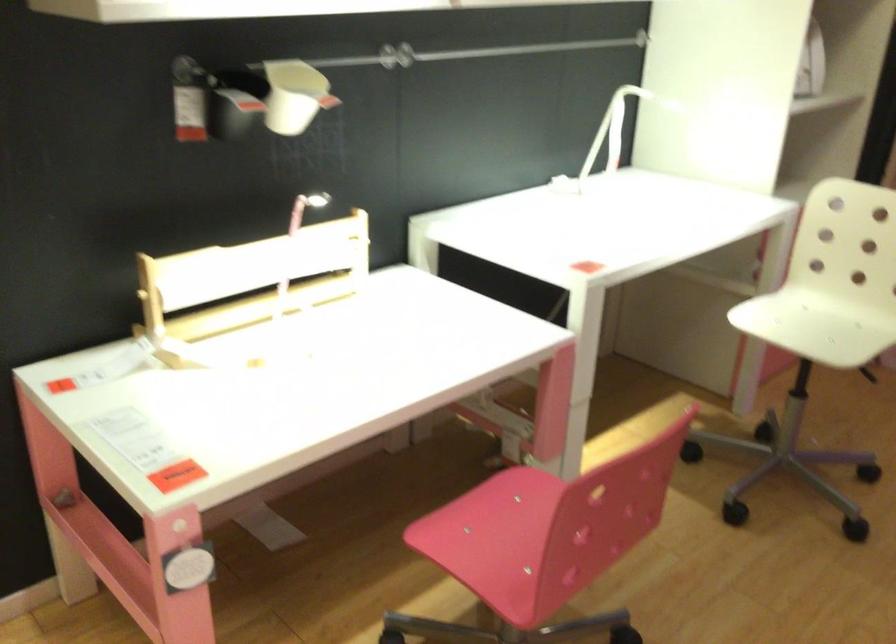
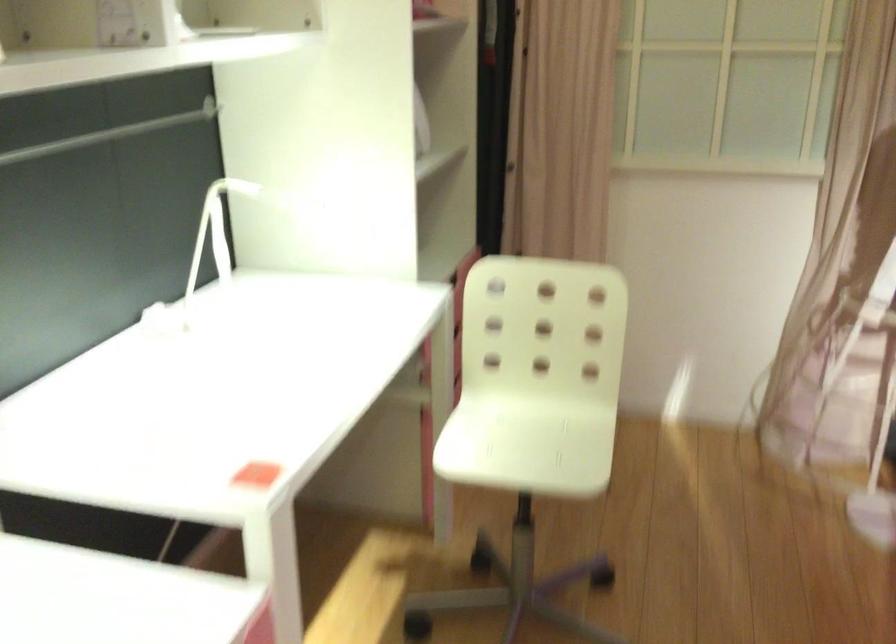
Question: Based on the continuous images, in which direction is the camera rotating? Reply with the corresponding letter.

Choices:
 (A) Left
 (B) Right
 (C) Up
 (D) Down

Answer: (B)